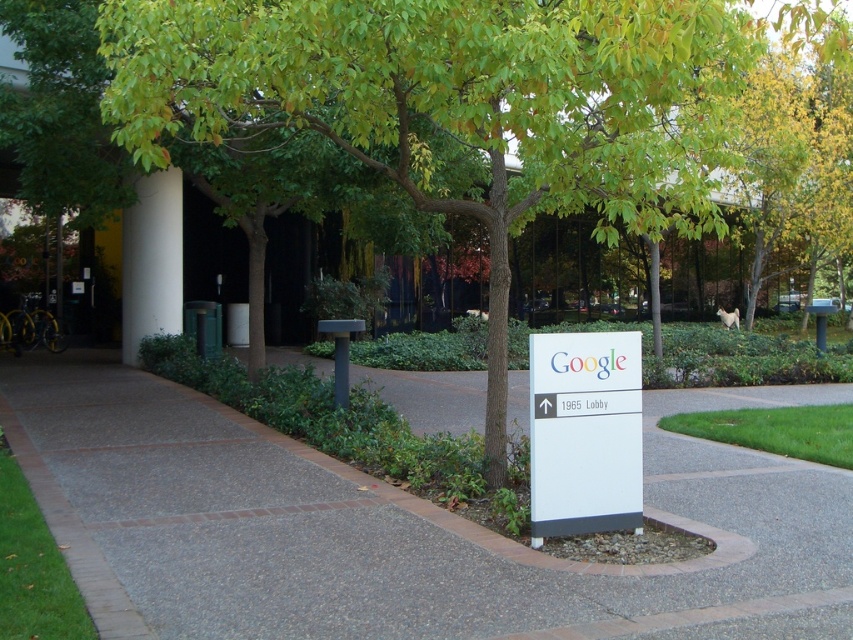
You are standing at the entrance of the Google facility and want to walk towards the building. There are two points marked on the path, one at point coordinates point [196,532] and another at point [154,253]. Which point is closer to you as you start walking towards the building?

Point [196,532] is closer to the viewer than point [154,253], so the point at coordinates point [196,532] is closer to you as you start walking towards the building.

From the picture: You are standing at the entrance of the Google facility and want to walk to the point that is closer to you. Which point should you head towards, point (555, 403) or point (149, 256)?

You should head towards point (555, 403) because it is closer to the viewer than point (149, 256).